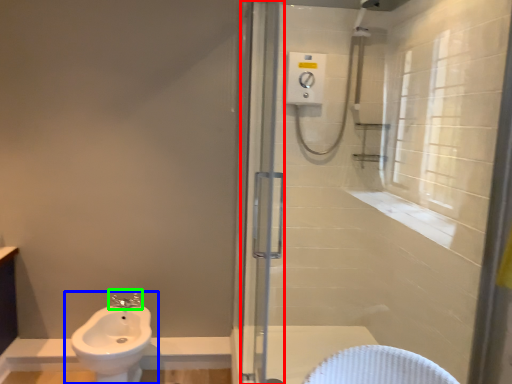
Question: Estimate the real-world distances between objects in this image. Which object is farther from screen door (highlighted by a red box), sink (highlighted by a blue box) or tap (highlighted by a green box)?

Choices:
 (A) sink
 (B) tap

Answer: (B)